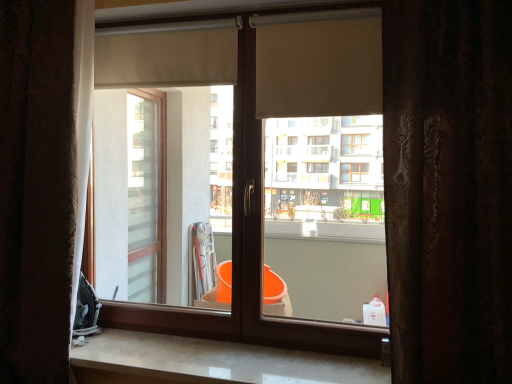
The width and height of the screenshot is (512, 384). I want to click on free spot above beige fabric roller at upper left, the first shutter from the left (from a real-world perspective), so click(x=170, y=23).